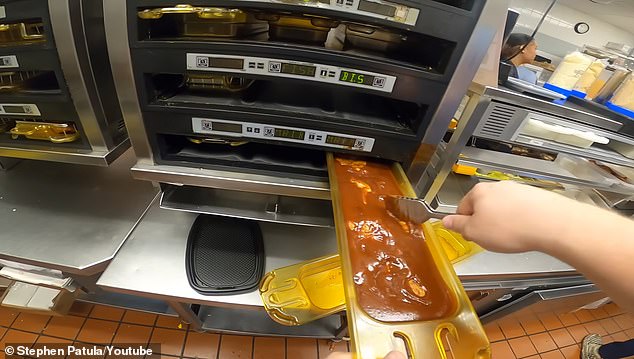
Find the location of a particular element. The width and height of the screenshot is (634, 359). shelf is located at coordinates (150, 277), (89, 232).